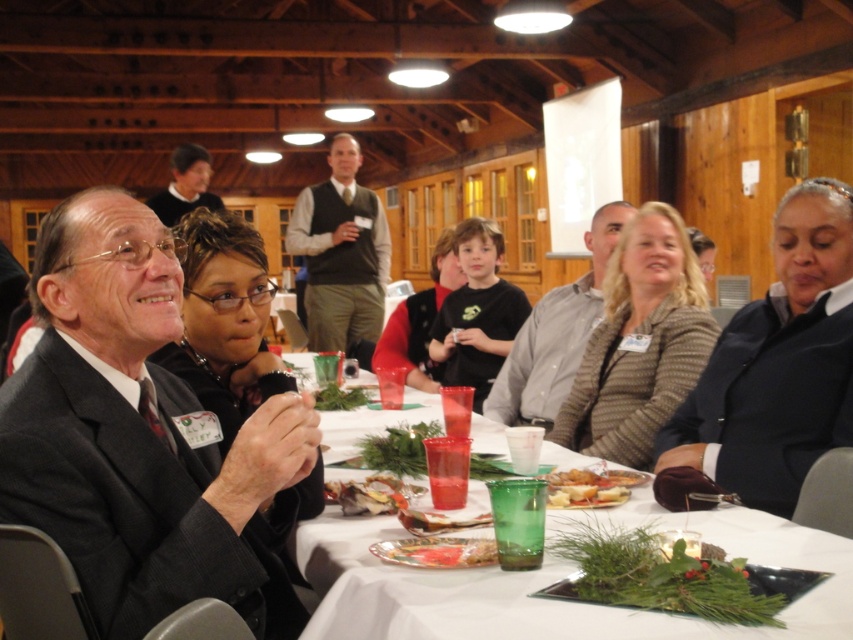
From the picture: You are standing at the entrance of the room and want to hand a document to the person holding the green glass at center. Which direction should you walk to reach them?

The green glass at center is located at point [543,586] in the image, so you should walk toward the center of the table to reach them.

You are standing at the front of the room facing the table. Which of the two points, point (606,259) or point (445,497), is closer to you?

Point (445,497) is closer to you because it is in front of point (606,259).

Where is the gray shirt at center located in the image?

The gray shirt at center is located at point coordinates of 0.523 on the x axis and 0.652 on the y axis.